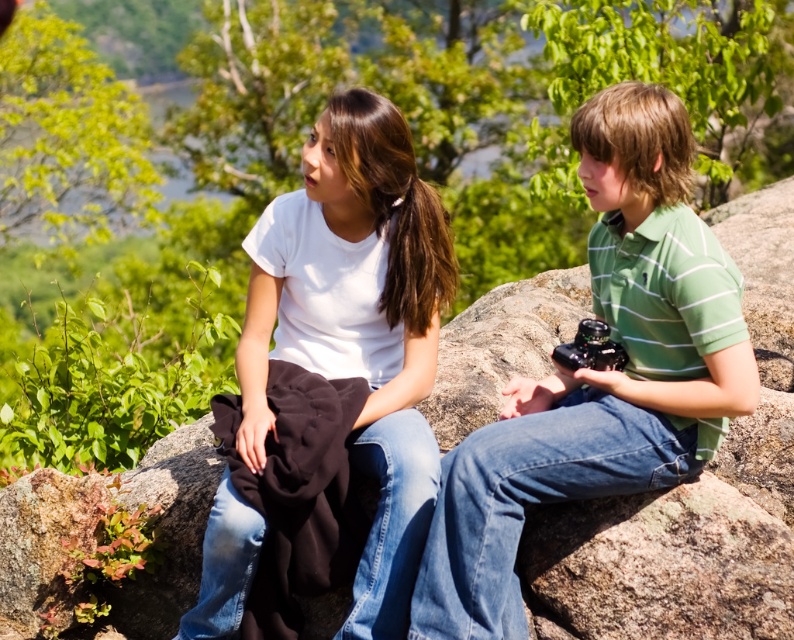
Question: Which point is closer to the camera?

Choices:
 (A) green striped polo shirt at right
 (B) white matte t-shirt at center

Answer: (A)

Question: Among these points, which one is farthest from the camera?

Choices:
 (A) (653, 202)
 (B) (360, 362)

Answer: (B)

Question: Does green striped polo shirt at right lie behind white matte t-shirt at center?

Choices:
 (A) no
 (B) yes

Answer: (A)

Question: Which object is farther from the camera taking this photo?

Choices:
 (A) white matte t-shirt at center
 (B) green striped polo shirt at right

Answer: (A)

Question: Is green striped polo shirt at right to the right of white matte t-shirt at center from the viewer's perspective?

Choices:
 (A) yes
 (B) no

Answer: (A)

Question: Does green striped polo shirt at right lie in front of white matte t-shirt at center?

Choices:
 (A) no
 (B) yes

Answer: (B)